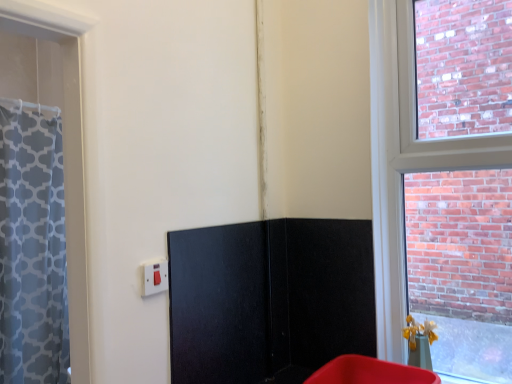
Question: From a real-world perspective, is matte white switch at lower left positioned over matte plastic bin at lower right based on gravity?

Choices:
 (A) yes
 (B) no

Answer: (A)

Question: Are matte white switch at lower left and matte plastic bin at lower right beside each other?

Choices:
 (A) yes
 (B) no

Answer: (B)

Question: Is matte white switch at lower left further to camera compared to matte plastic bin at lower right?

Choices:
 (A) yes
 (B) no

Answer: (A)

Question: Considering the relative sizes of matte white switch at lower left and matte plastic bin at lower right in the image provided, is matte white switch at lower left smaller than matte plastic bin at lower right?

Choices:
 (A) yes
 (B) no

Answer: (A)

Question: From the image's perspective, does matte white switch at lower left appear higher than matte plastic bin at lower right?

Choices:
 (A) no
 (B) yes

Answer: (B)

Question: Considering the relative positions of matte white switch at lower left and black matte screen door at center in the image provided, is matte white switch at lower left to the left or to the right of black matte screen door at center?

Choices:
 (A) right
 (B) left

Answer: (B)

Question: In terms of width, does matte white switch at lower left look wider or thinner when compared to black matte screen door at center?

Choices:
 (A) wide
 (B) thin

Answer: (B)

Question: From the image's perspective, is matte white switch at lower left positioned above or below black matte screen door at center?

Choices:
 (A) above
 (B) below

Answer: (A)

Question: Choose the correct answer: Is matte white switch at lower left inside black matte screen door at center or outside it?

Choices:
 (A) inside
 (B) outside

Answer: (B)

Question: From a real-world perspective, relative to matte white switch at lower left, is matte plastic bin at lower right vertically above or below?

Choices:
 (A) above
 (B) below

Answer: (B)

Question: Relative to matte white switch at lower left, is matte plastic bin at lower right in front or behind?

Choices:
 (A) front
 (B) behind

Answer: (A)

Question: Is point (406, 370) positioned closer to the camera than point (142, 281)?

Choices:
 (A) farther
 (B) closer

Answer: (A)

Question: Based on their sizes in the image, would you say matte plastic bin at lower right is bigger or smaller than matte white switch at lower left?

Choices:
 (A) small
 (B) big

Answer: (B)

Question: From a real-world perspective, is black matte screen door at center above or below matte plastic bin at lower right?

Choices:
 (A) below
 (B) above

Answer: (B)

Question: From their relative heights in the image, would you say black matte screen door at center is taller or shorter than matte plastic bin at lower right?

Choices:
 (A) short
 (B) tall

Answer: (B)